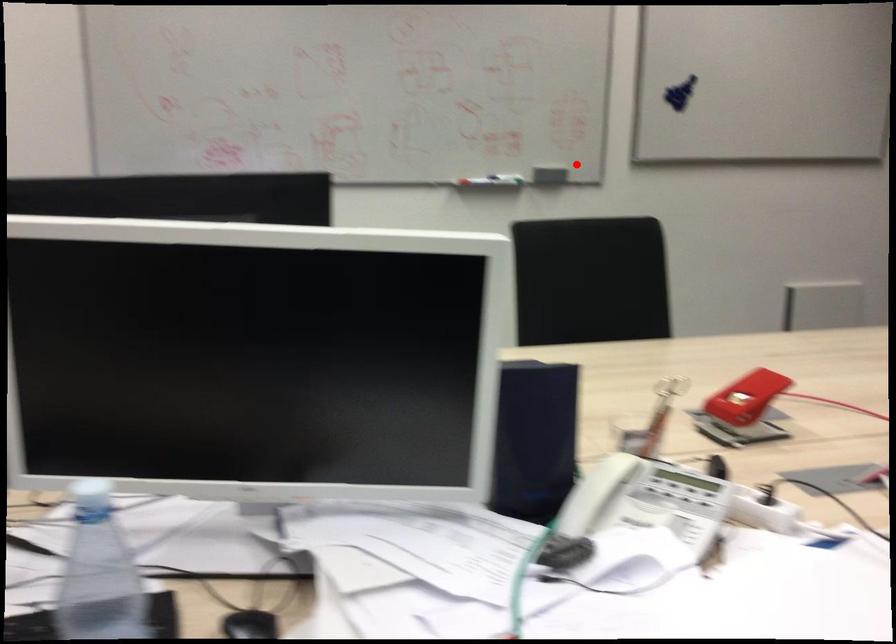
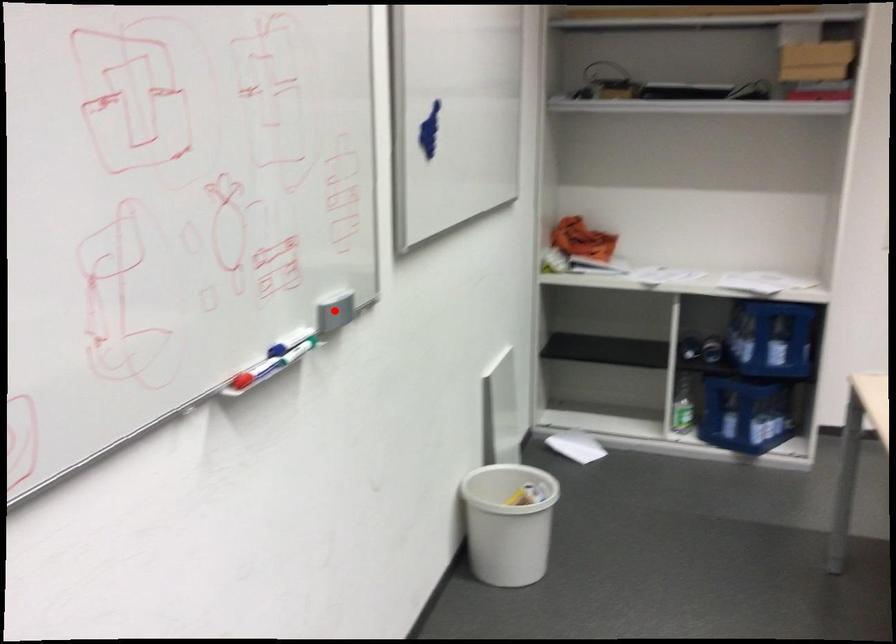
I am providing you with two images of the same scene from different viewpoints. A red point is marked on the first image and another point is marked on the second image. Do the highlighted points in image1 and image2 indicate the same real-world spot?

Yes